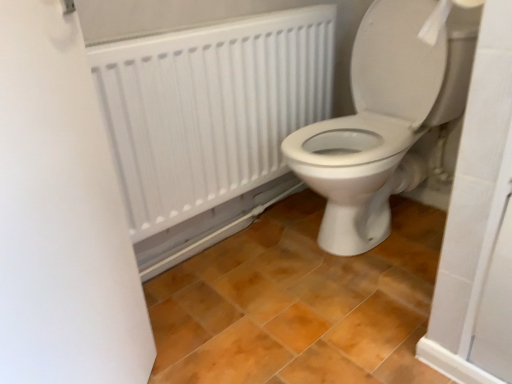
Find the location of a particular element. white matte screen door at left is located at coordinates (62, 215).

The width and height of the screenshot is (512, 384). In order to click on white glossy toilet at center in this screenshot , I will do `click(384, 119)`.

Find the location of a particular element. This screenshot has height=384, width=512. white matte radiator at upper center is located at coordinates (211, 108).

Between brown matte tile at center and white matte screen door at left, which one is positioned in front?

Positioned in front is white matte screen door at left.

Is brown matte tile at center smaller than white matte screen door at left?

Actually, brown matte tile at center might be larger than white matte screen door at left.

Is brown matte tile at center inside the boundaries of white matte screen door at left, or outside?

brown matte tile at center exists outside the volume of white matte screen door at left.

In terms of height, does white paper at upper right look taller or shorter compared to white matte radiator at upper center?

In the image, white paper at upper right appears to be shorter than white matte radiator at upper center.

Is point (447, 2) in front of point (125, 74)?

Yes, point (447, 2) is in front of point (125, 74).

What's the angular difference between white matte screen door at left and white matte radiator at upper center's facing directions?

The angle between the facing direction of white matte screen door at left and the facing direction of white matte radiator at upper center is 44.3 degrees.

Is white matte screen door at left looking in the opposite direction of white matte radiator at upper center?

No, white matte screen door at left's orientation is not away from white matte radiator at upper center.

Are white matte screen door at left and white matte radiator at upper center making contact?

white matte screen door at left and white matte radiator at upper center are clearly separated.

From a real-world perspective, who is located higher, white matte screen door at left or white matte radiator at upper center?

From a 3D spatial view, white matte radiator at upper center is above.

Between brown matte tile at center and white paper at upper right, which one has smaller width?

With smaller width is white paper at upper right.

How different are the orientations of brown matte tile at center and white paper at upper right in degrees?

There is a 93.6-degree angle between the facing directions of brown matte tile at center and white paper at upper right.

From the image's perspective, which object appears higher, brown matte tile at center or white paper at upper right?

From the image's view, white paper at upper right is above.

Considering the sizes of objects white matte radiator at upper center and white glossy toilet at center in the image provided, who is shorter, white matte radiator at upper center or white glossy toilet at center?

With less height is white matte radiator at upper center.

From a real-world perspective, is white matte radiator at upper center beneath white glossy toilet at center?

Actually, white matte radiator at upper center is physically above white glossy toilet at center in the real world.

From the picture: In terms of size, does white matte radiator at upper center appear bigger or smaller than white glossy toilet at center?

white matte radiator at upper center is smaller than white glossy toilet at center.

From the image's perspective, between white matte radiator at upper center and white glossy toilet at center, which one is located above?

white matte radiator at upper center appears higher in the image.

Locate an element on the screen. This screenshot has width=512, height=384. radiator behind the brown matte tile at center is located at coordinates (211, 108).

Can you confirm if white matte radiator at upper center is taller than brown matte tile at center?

Correct, white matte radiator at upper center is much taller as brown matte tile at center.

How different are the orientations of white matte radiator at upper center and brown matte tile at center in degrees?

white matte radiator at upper center and brown matte tile at center are facing 90.7 degrees away from each other.

Does white glossy toilet at center come in front of white paper at upper right?

No, it is behind white paper at upper right.

From the image's perspective, is white glossy toilet at center above or below white paper at upper right?

white glossy toilet at center is situated lower than white paper at upper right in the image.

Are white glossy toilet at center and white paper at upper right far apart?

They are positioned close to each other.

From a real-world perspective, is white glossy toilet at center under white paper at upper right?

Correct, in the physical world, white glossy toilet at center is lower than white paper at upper right.

Find the location of a particular element. Image resolution: width=512 pixels, height=384 pixels. ceramic tile located below the white matte screen door at left (from the image's perspective) is located at coordinates (298, 303).

Find the location of a particular element. The width and height of the screenshot is (512, 384). toilet paper above the white matte radiator at upper center (from the image's perspective) is located at coordinates (442, 18).

Based on their spatial positions, is white matte radiator at upper center or white matte screen door at left closer to white paper at upper right?

white matte radiator at upper center is positioned closer to the anchor white paper at upper right.

When comparing their distances from white matte radiator at upper center, does white paper at upper right or brown matte tile at center seem closer?

Based on the image, brown matte tile at center appears to be nearer to white matte radiator at upper center.

From the image, which object appears to be nearer to white glossy toilet at center, brown matte tile at center or white matte radiator at upper center?

The object closer to white glossy toilet at center is white matte radiator at upper center.

Based on their spatial positions, is brown matte tile at center or white glossy toilet at center closer to white matte screen door at left?

brown matte tile at center is positioned closer to the anchor white matte screen door at left.

When comparing their distances from white matte radiator at upper center, does brown matte tile at center or white glossy toilet at center seem further?

brown matte tile at center.

Considering their positions, is white matte radiator at upper center positioned further to white paper at upper right than brown matte tile at center?

Based on the image, brown matte tile at center appears to be further to white paper at upper right.

Based on their spatial positions, is white paper at upper right or white glossy toilet at center further from white matte screen door at left?

white paper at upper right is positioned further to the anchor white matte screen door at left.

When comparing their distances from white glossy toilet at center, does white matte screen door at left or white matte radiator at upper center seem closer?

Based on the image, white matte radiator at upper center appears to be nearer to white glossy toilet at center.

Identify the location of toilet between white paper at upper right and brown matte tile at center vertically. The width and height of the screenshot is (512, 384). (384, 119).

Locate an element on the screen. ceramic tile between white matte screen door at left and white glossy toilet at center from left to right is located at coordinates point(298,303).

Locate an element on the screen. This screenshot has width=512, height=384. ceramic tile between white matte screen door at left and white matte radiator at upper center in the front-back direction is located at coordinates (298, 303).

Identify the location of toilet that lies between white matte radiator at upper center and brown matte tile at center from top to bottom. (384, 119).